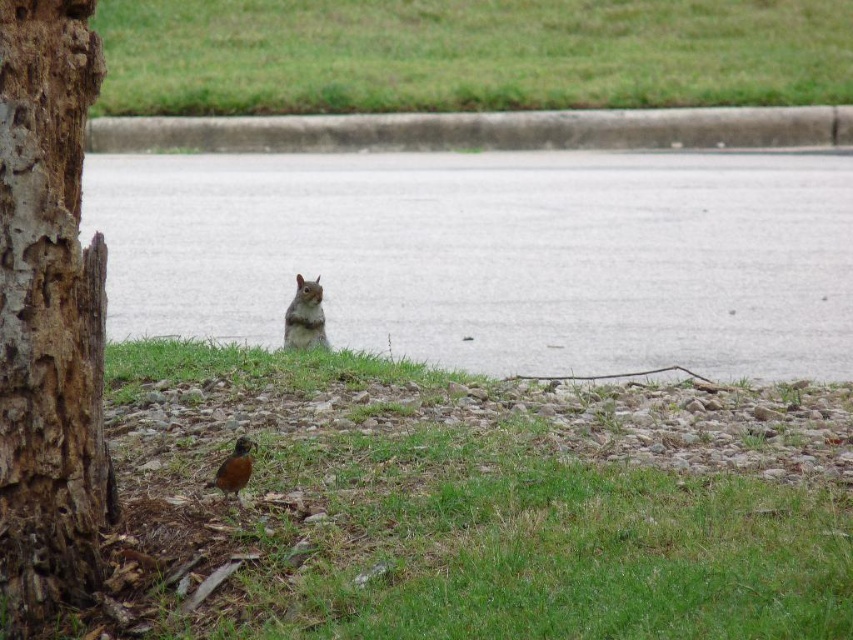
Does point (395, 618) come closer to viewer compared to point (27, 508)?

That is True.

Find the location of `green grass at lower center`. green grass at lower center is located at coordinates (480, 499).

Is brown rough bark tree trunk at left smaller than concrete curb at upper center?

No, brown rough bark tree trunk at left is not smaller than concrete curb at upper center.

From the picture: Is brown rough bark tree trunk at left bigger than concrete curb at upper center?

Indeed, brown rough bark tree trunk at left has a larger size compared to concrete curb at upper center.

The height and width of the screenshot is (640, 853). In order to click on brown rough bark tree trunk at left in this screenshot , I will do `click(49, 314)`.

Where is `brown rough bark tree trunk at left`? brown rough bark tree trunk at left is located at coordinates (49, 314).

Image resolution: width=853 pixels, height=640 pixels. I want to click on green grass at upper center, so click(468, 54).

Is green grass at upper center smaller than concrete curb at upper center?

No.

At what (x,y) coordinates should I click in order to perform the action: click on green grass at upper center. Please return your answer as a coordinate pair (x, y). Image resolution: width=853 pixels, height=640 pixels. Looking at the image, I should click on (468, 54).